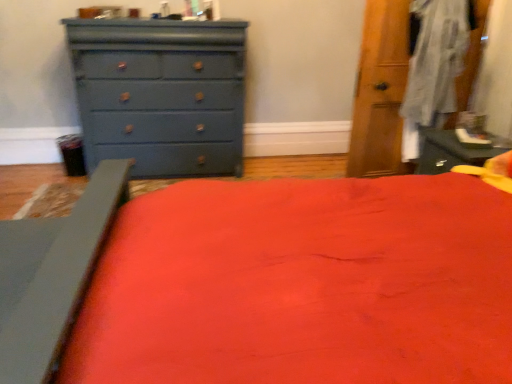
Question: Based on their sizes in the image, would you say matte blue dresser at left is bigger or smaller than matte gray bed frame at lower left?

Choices:
 (A) big
 (B) small

Answer: (A)

Question: Considering their positions, is matte blue dresser at left located in front of or behind matte gray bed frame at lower left?

Choices:
 (A) behind
 (B) front

Answer: (A)

Question: Is matte blue dresser at left taller or shorter than matte gray bed frame at lower left?

Choices:
 (A) tall
 (B) short

Answer: (A)

Question: Based on their positions, is matte gray bed frame at lower left located to the left or right of matte blue dresser at left?

Choices:
 (A) right
 (B) left

Answer: (B)

Question: Is matte gray bed frame at lower left inside the boundaries of matte blue dresser at left, or outside?

Choices:
 (A) inside
 (B) outside

Answer: (B)

Question: Considering the positions of matte gray bed frame at lower left and matte blue dresser at left in the image, is matte gray bed frame at lower left taller or shorter than matte blue dresser at left?

Choices:
 (A) tall
 (B) short

Answer: (B)

Question: From a real-world perspective, relative to matte blue dresser at left, is matte gray bed frame at lower left vertically above or below?

Choices:
 (A) above
 (B) below

Answer: (B)